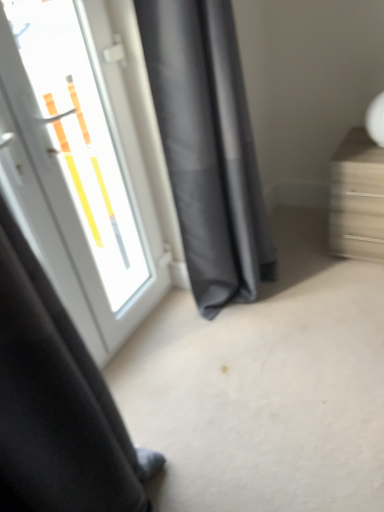
In order to click on vacant area that lies in front of dark gray fabric curtain at center in this screenshot , I will do `click(268, 341)`.